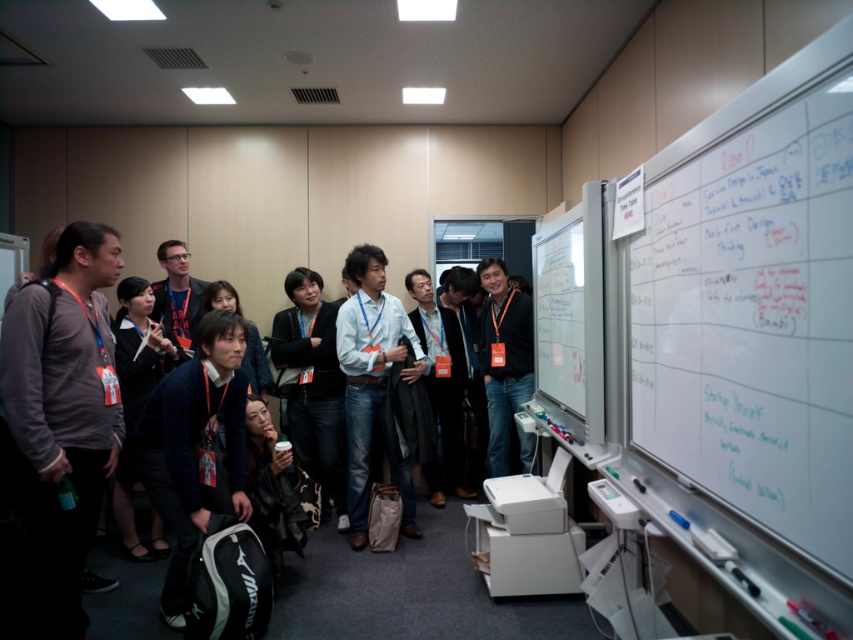
Question: Does whiteboard at upper right come behind dark gray sweater at center?

Choices:
 (A) yes
 (B) no

Answer: (B)

Question: Considering the real-world distances, which object is farthest from the black matte jacket at center?

Choices:
 (A) gray matte shirt at left
 (B) dark gray sweater at center

Answer: (A)

Question: Is gray matte shirt at left smaller than dark gray sweater at center?

Choices:
 (A) yes
 (B) no

Answer: (B)

Question: Which object is closer to the camera taking this photo?

Choices:
 (A) dark gray sweater at center
 (B) gray matte shirt at left
 (C) black matte jacket at center

Answer: (B)

Question: Based on their relative distances, which object is farther from the gray matte shirt at left?

Choices:
 (A) dark gray sweater at center
 (B) black matte jacket at center

Answer: (B)

Question: Is whiteboard at upper right positioned before gray matte shirt at left?

Choices:
 (A) no
 (B) yes

Answer: (B)